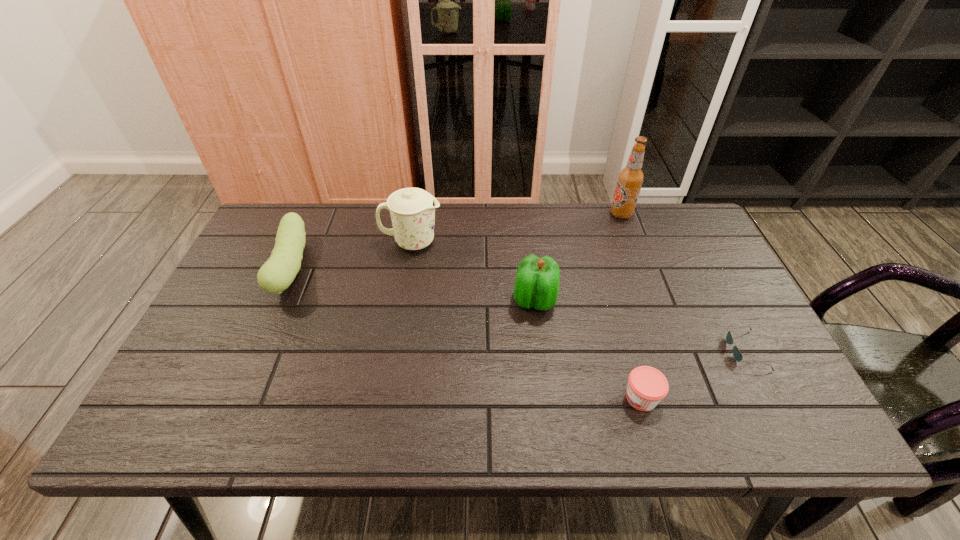
You are a GUI agent. You are given a task and a screenshot of the screen. Output one action in this format:
    pyautogui.click(x=<x>, y=<y>)
    Task: Click on the shortest object
    The image size is (960, 540).
    Given the screenshot: What is the action you would take?
    pyautogui.click(x=737, y=355)

The image size is (960, 540). I want to click on the second nearest object, so click(737, 355).

Locate an element on the screen. The width and height of the screenshot is (960, 540). vacant area situated on the front label of the farthest object is located at coordinates coord(521,214).

Identify the location of vacant space situated 0.060m on the front label of the farthest object. (591, 214).

This screenshot has height=540, width=960. I want to click on free region located on the front label of the farthest object, so click(585, 214).

Locate an element on the screen. This screenshot has height=540, width=960. free spot located on the spout of the chinaware is located at coordinates (524, 242).

At what (x,y) coordinates should I click in order to perform the action: click on free spot located 0.210m on the right of the third tallest object. Please return your answer as a coordinate pair (x, y). Image resolution: width=960 pixels, height=540 pixels. Looking at the image, I should click on (636, 300).

This screenshot has height=540, width=960. Identify the location of vacant area situated on the right of the fourth tallest object. (359, 268).

Find the location of a particular element. The height and width of the screenshot is (540, 960). vacant region located on the front label of the nearest object is located at coordinates (446, 398).

Where is `free point located 0.220m on the front label of the nearest object`? The image size is (960, 540). free point located 0.220m on the front label of the nearest object is located at coordinates (523, 398).